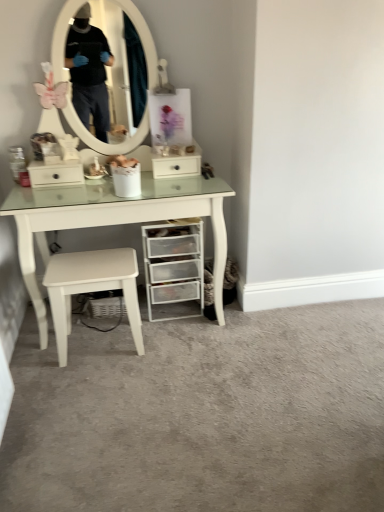
Find the location of `free space above white matte stool at lower center (from a real-world perspective)`. free space above white matte stool at lower center (from a real-world perspective) is located at coordinates 91,267.